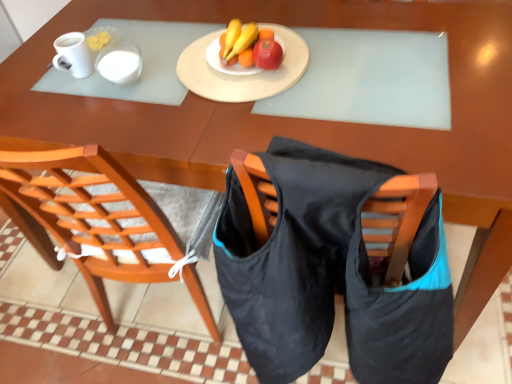
Find the location of a particular element. The height and width of the screenshot is (384, 512). space that is in front of white glossy mug at upper left is located at coordinates (102, 111).